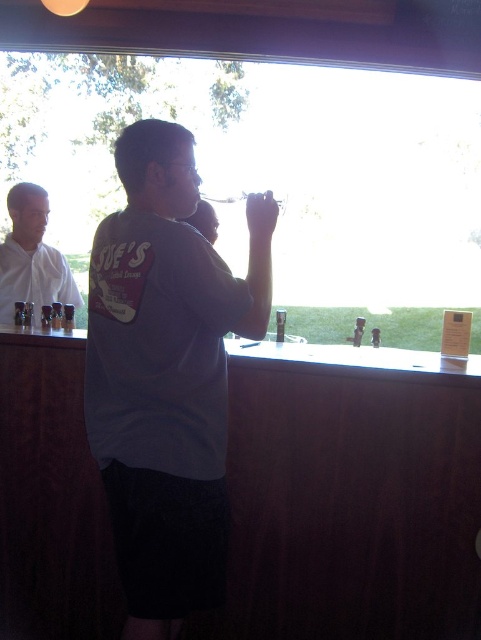
Does gray cotton shirt at center appear on the right side of white matte shirt at left?

Correct, you'll find gray cotton shirt at center to the right of white matte shirt at left.

Describe the element at coordinates (166, 376) in the screenshot. I see `gray cotton shirt at center` at that location.

In order to click on gray cotton shirt at center in this screenshot , I will do `click(166, 376)`.